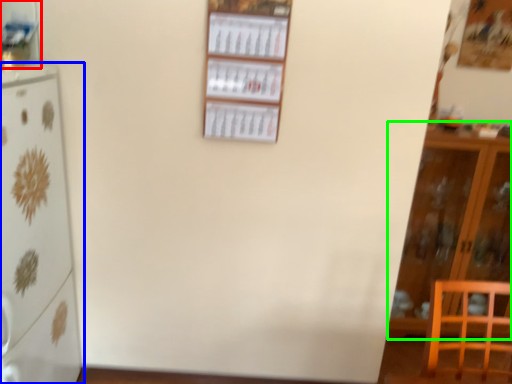
Question: Based on their relative distances, which object is nearer to shelf (highlighted by a red box)? Choose from refrigerator (highlighted by a blue box) and cabinetry (highlighted by a green box).

Choices:
 (A) refrigerator
 (B) cabinetry

Answer: (A)